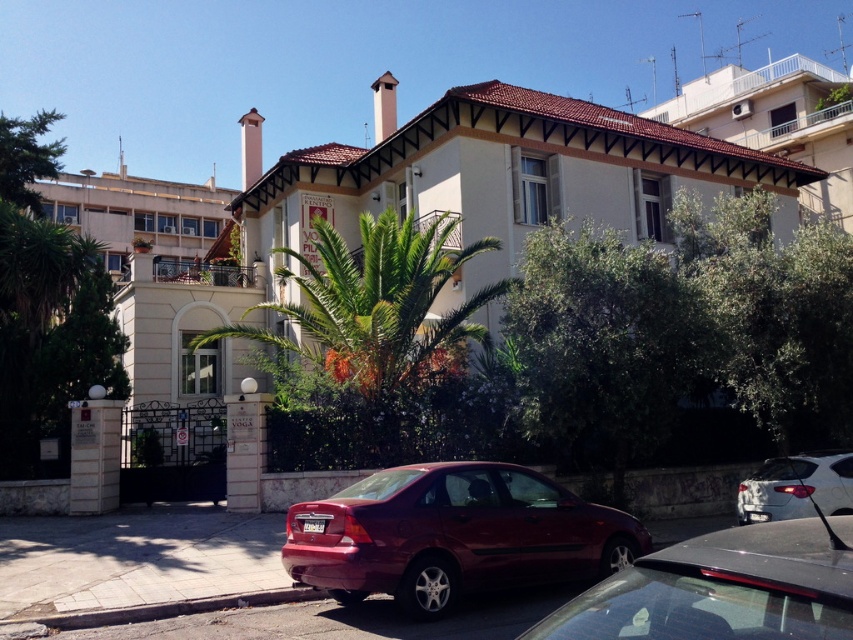
Between shiny red sedan at lower center and white glossy sedan at lower right, which one has more height?

shiny red sedan at lower center is taller.

Is point (485, 584) behind point (759, 488)?

No.

The height and width of the screenshot is (640, 853). In order to click on shiny red sedan at lower center in this screenshot , I will do (x=453, y=536).

Between point (666, 636) and point (798, 515), which one is positioned behind?

The point (798, 515) is more distant.

Is shiny black sedan at center shorter than white glossy sedan at lower right?

Correct, shiny black sedan at center is not as tall as white glossy sedan at lower right.

Does point (633, 573) come closer to viewer compared to point (805, 477)?

Yes, it is.

Where is `shiny black sedan at center`? shiny black sedan at center is located at coordinates (722, 589).

Is point (488, 579) closer to camera compared to point (807, 600)?

No, it is not.

Does shiny red sedan at lower center come in front of shiny black sedan at center?

No, shiny red sedan at lower center is behind shiny black sedan at center.

What are the coordinates of `shiny red sedan at lower center` in the screenshot? It's located at (453, 536).

Where is `shiny red sedan at lower center`? shiny red sedan at lower center is located at coordinates (453, 536).